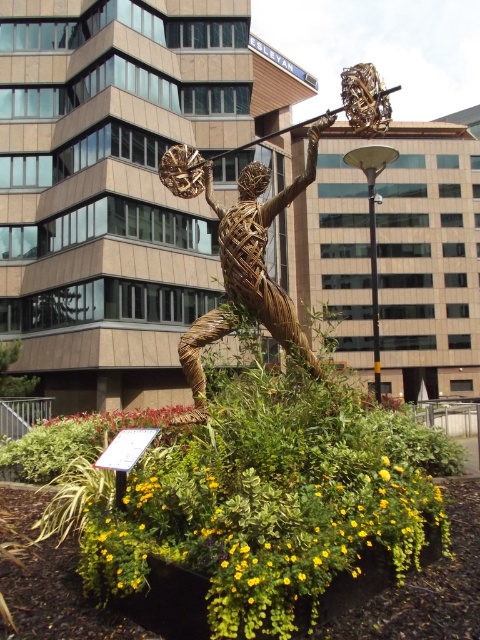
Does braided wicker figure at center have a smaller size compared to black metal pole at center?

Correct, braided wicker figure at center occupies less space than black metal pole at center.

Between point (241, 275) and point (372, 273), which one is positioned in front?

Positioned in front is point (241, 275).

The height and width of the screenshot is (640, 480). I want to click on braided wicker figure at center, so click(x=262, y=246).

Who is more forward, [369,486] or [371,147]?

Positioned in front is point [369,486].

Identify the location of yellow-green leaves at center. The width and height of the screenshot is (480, 640). (261, 544).

Who is lower down, yellow-green leaves at center or braided wicker figure at center?

yellow-green leaves at center is lower down.

Who is more forward, (124, 520) or (250, 205)?

Positioned in front is point (124, 520).

Image resolution: width=480 pixels, height=640 pixels. Find the location of `yellow-green leaves at center`. yellow-green leaves at center is located at coordinates (261, 544).